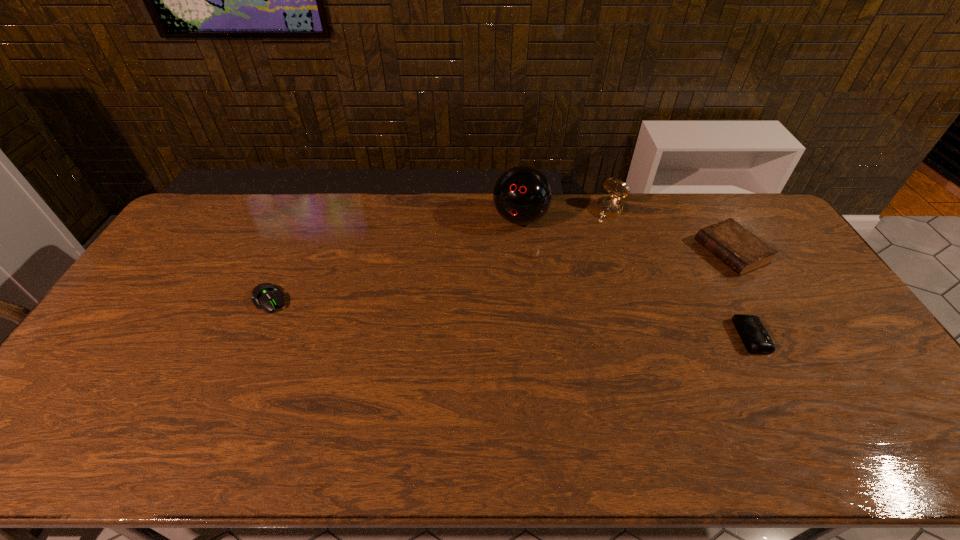
Find the location of a particular element. The height and width of the screenshot is (540, 960). vacant area in the image that satisfies the following two spatial constraints: 1. on the front side of the computer mouse; 2. on the display of the nearest object is located at coordinates (253, 336).

I want to click on vacant space that satisfies the following two spatial constraints: 1. on the front side of the nearest object; 2. on the display of the compass, so click(x=652, y=336).

I want to click on free spot that satisfies the following two spatial constraints: 1. on the front side of the computer mouse; 2. on the display of the alarm clock, so click(253, 336).